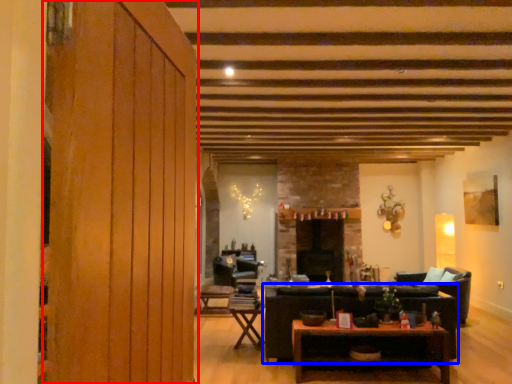
Question: Which of the following is the farthest to the observer, barn door (highlighted by a red box) or studio couch (highlighted by a blue box)?

Choices:
 (A) barn door
 (B) studio couch

Answer: (B)